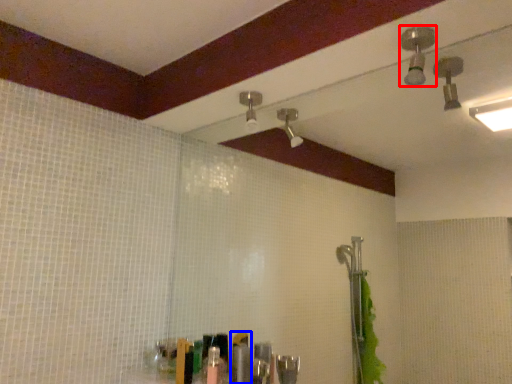
Question: Which point is further to the camera, shower (highlighted by a red box) or toiletry (highlighted by a blue box)?

Choices:
 (A) shower
 (B) toiletry

Answer: (B)